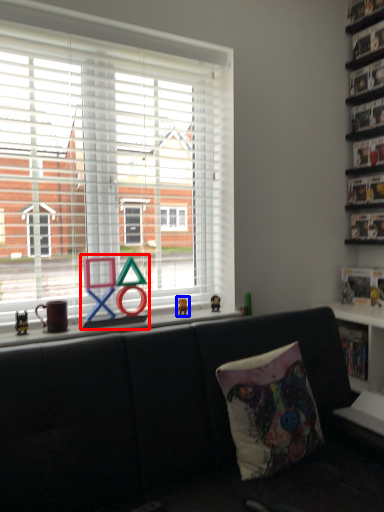
Question: Among these objects, which one is farthest to the camera, toy (highlighted by a red box) or miniature (highlighted by a blue box)?

Choices:
 (A) toy
 (B) miniature

Answer: (B)